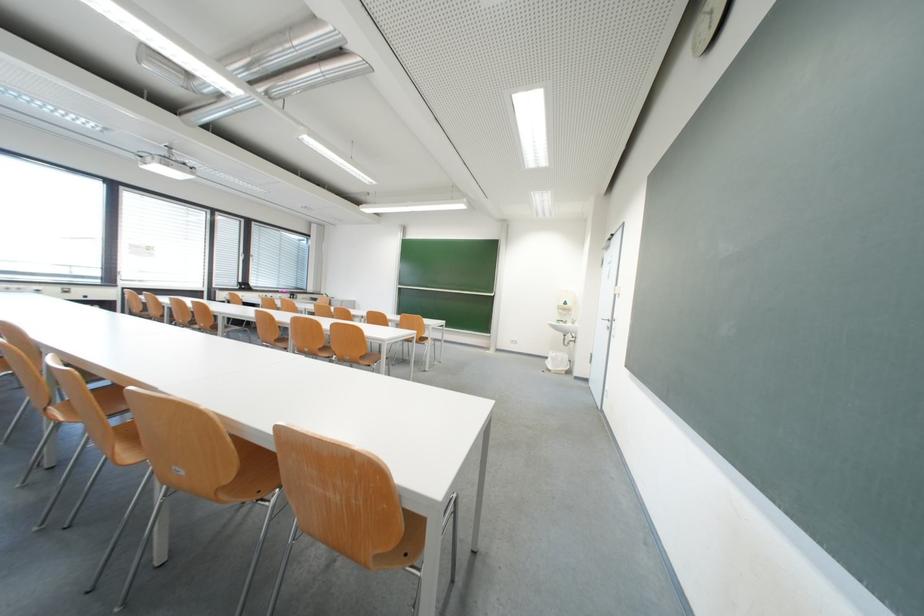
What do you see at coordinates (617, 325) in the screenshot?
I see `the black window handle` at bounding box center [617, 325].